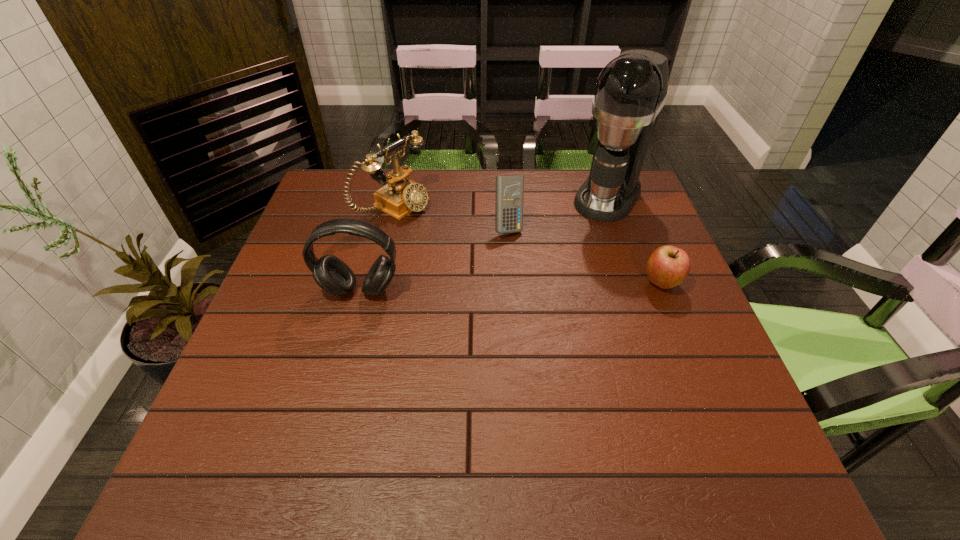
This screenshot has width=960, height=540. I want to click on telephone that is at the left edge, so click(401, 196).

I want to click on apple that is at the right edge, so click(667, 266).

This screenshot has height=540, width=960. In order to click on coffee maker that is at the right edge in this screenshot , I will do (631, 90).

Find the location of `object that is positioned at the far left corner`. object that is positioned at the far left corner is located at coordinates (401, 196).

Find the location of a particular element. This screenshot has height=540, width=960. object that is positioned at the far right corner is located at coordinates (631, 90).

You are a GUI agent. You are given a task and a screenshot of the screen. Output one action in this format:
    pyautogui.click(x=<x>, y=<y>)
    Task: Click on the free region at the far edge of the desktop
    The width and height of the screenshot is (960, 540).
    Given the screenshot: What is the action you would take?
    pyautogui.click(x=572, y=183)

Where is `vacant space at the near edge`? The width and height of the screenshot is (960, 540). vacant space at the near edge is located at coordinates (408, 396).

Locate an element on the screen. vacant space at the left edge is located at coordinates (281, 325).

In the image, there is a desktop. Where is `vacant space at the right edge`? The image size is (960, 540). vacant space at the right edge is located at coordinates (706, 372).

Locate an element on the screen. This screenshot has width=960, height=540. free point between the third object from left to right and the tallest object is located at coordinates (558, 212).